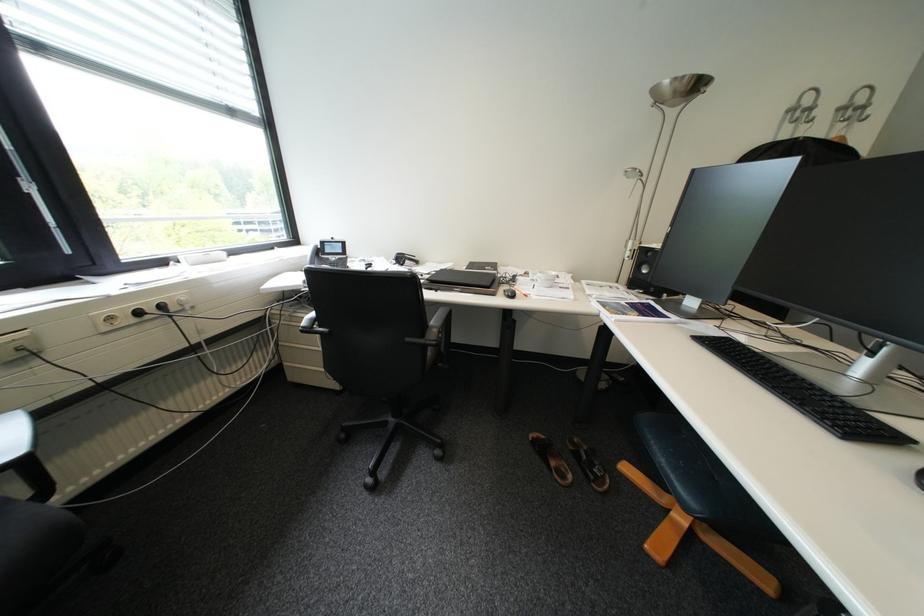
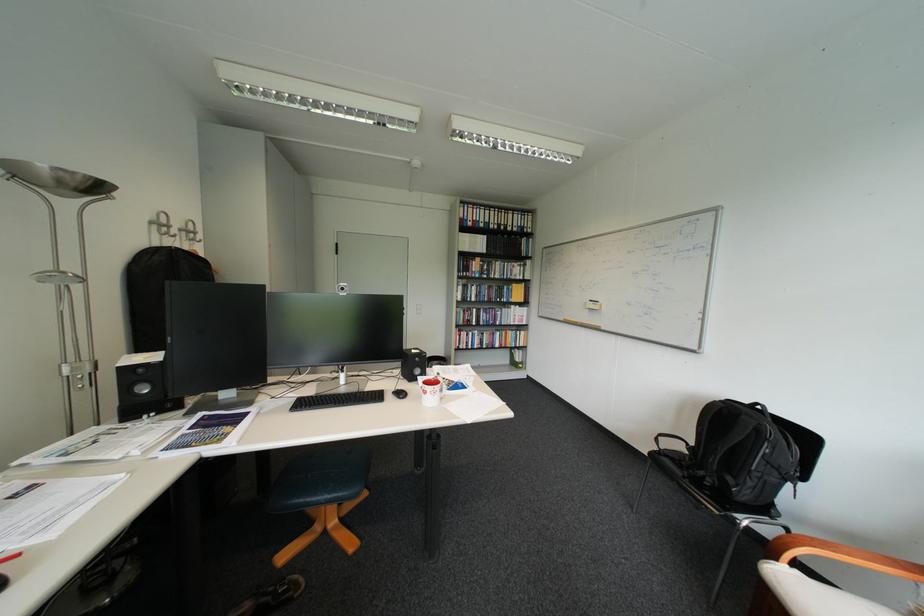
In the second image, find the point that corresponds to (662,437) in the first image.

(313, 501)